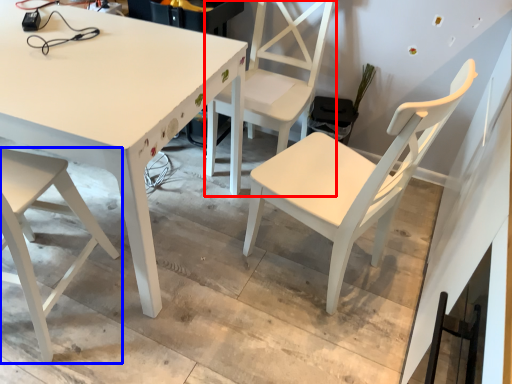
Question: Among these objects, which one is farthest to the camera, chair (highlighted by a red box) or chair (highlighted by a blue box)?

Choices:
 (A) chair
 (B) chair

Answer: (A)